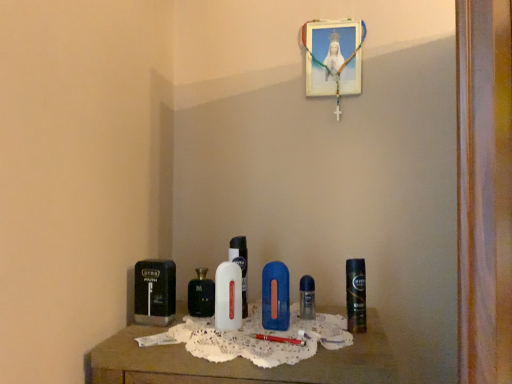
Question: Which is correct: wooden table at center is inside white plastic bottle at center, acting as the third perfume starting from the left, or outside of it?

Choices:
 (A) outside
 (B) inside

Answer: (A)

Question: From a real-world perspective, is wooden table at center above or below white plastic bottle at center, which appears as the 2th perfume when viewed from the front?

Choices:
 (A) below
 (B) above

Answer: (A)

Question: Estimate the real-world distances between objects in this image. Which object is closer to the white plastic bottle at center, the 2th perfume in the right-to-left sequence?

Choices:
 (A) wooden picture frame at upper center
 (B) black plastic razor at left, the first personal care when ordered from left to right
 (C) wooden table at center
 (D) clear plastic perfume at center, the 3th perfume positioned from the front
 (E) white glossy bottle at center, the 4th perfume when ordered from back to front

Answer: (E)

Question: Which of these objects is positioned farthest from the wooden picture frame at upper center?

Choices:
 (A) white glossy bottle at center, the 4th perfume when ordered from back to front
 (B) blue plastic razor at center, arranged as the second personal care when viewed from the right
 (C) shiny metallic deodorant at right, placed as the first personal care when sorted from right to left
 (D) clear plastic perfume at center, which appears as the first perfume when viewed from the right
 (E) black plastic razor at left, the first personal care when ordered from left to right

Answer: (E)